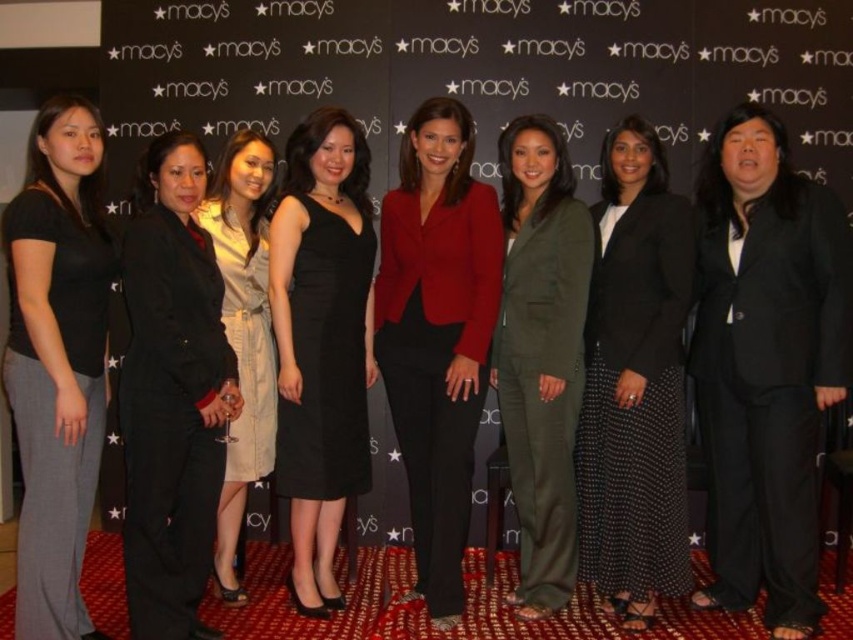
You are a photographer at a Macy store event. You need to take a photo of the black matte suit at left and the matte olive green suit at center. Which one is positioned to the left of the other?

The black matte suit at left is positioned to the left of the matte olive green suit at center.

You are a photographer at a red carpet event. You need to arrange the black matte suit at left and the matte olive green suit at center so that both are visible in the photo. Given their heights, which suit should be placed in the front to ensure both are fully visible?

The black matte suit at left is shorter than the matte olive green suit at center. To ensure both are fully visible, the black matte suit at left should be placed in the front so that the taller matte olive green suit at center can be seen behind it without obstruction.